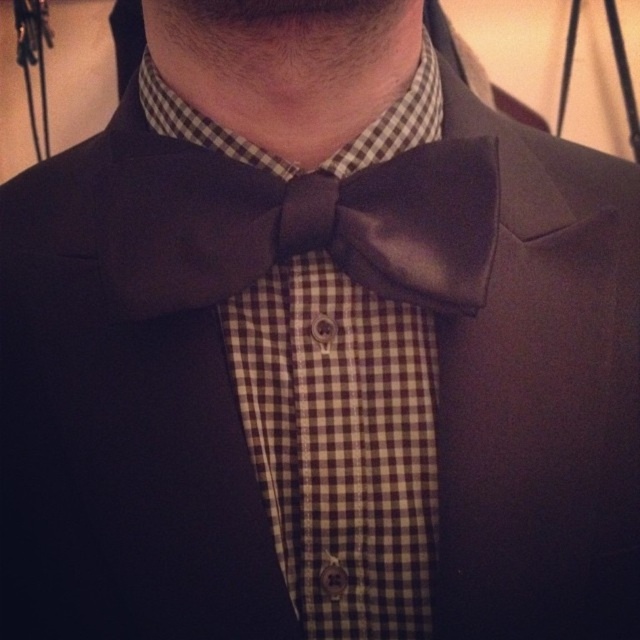
You are a tailor adjusting the length of the sleeves on a suit jacket. You notice the brown checkered shirt at center and the shiny brown bow tie at center. Which of these items has a greater height?

The brown checkered shirt at center has a greater height compared to the shiny brown bow tie at center, so the brown checkered shirt at center is taller.

You are a fashion designer analyzing this outfit. You notice the shiny brown bow tie at center and the white checkered fabric at center. Which one is located to the left?

The shiny brown bow tie at center is positioned on the left side of the white checkered fabric at center.